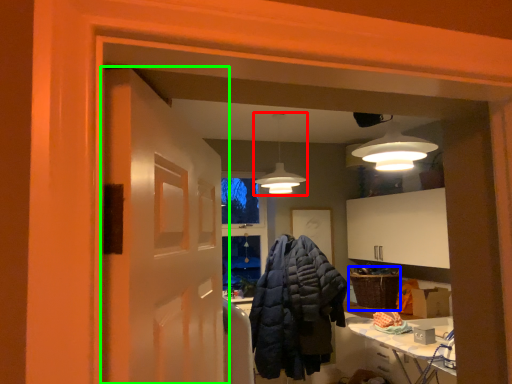
Question: Which is nearer to the lighting (highlighted by a red box)? basket (highlighted by a blue box) or door (highlighted by a green box).

Choices:
 (A) basket
 (B) door

Answer: (A)